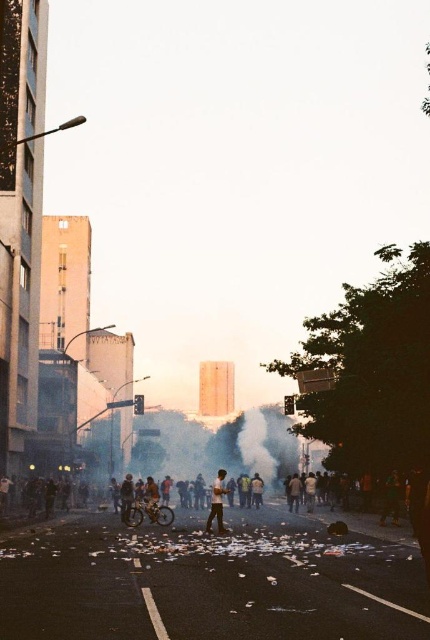
You are a pedestrian trying to cross the street in the image. You see the white fog at center and the light brown leather jacket at center. Which object is closer to the ground?

The white fog at center is located below light brown leather jacket at center, so the white fog at center is closer to the ground.

Looking at this image, you are a photographer standing on the sidewalk capturing the protest scene. You notice the white fog at center and the light brown leather jacket at center in your frame. Which object appears closer to you in the photograph?

The light brown leather jacket at center appears closer to you because the white fog at center is further away, creating a layering effect in the image.

You are a pedestrian trying to cross the street while avoiding the white fog at center and the light brown leather jacket at center. Which object is taller and might obstruct your view more?

The white fog at center has a greater height compared to the light brown leather jacket at center, so it might obstruct your view more.